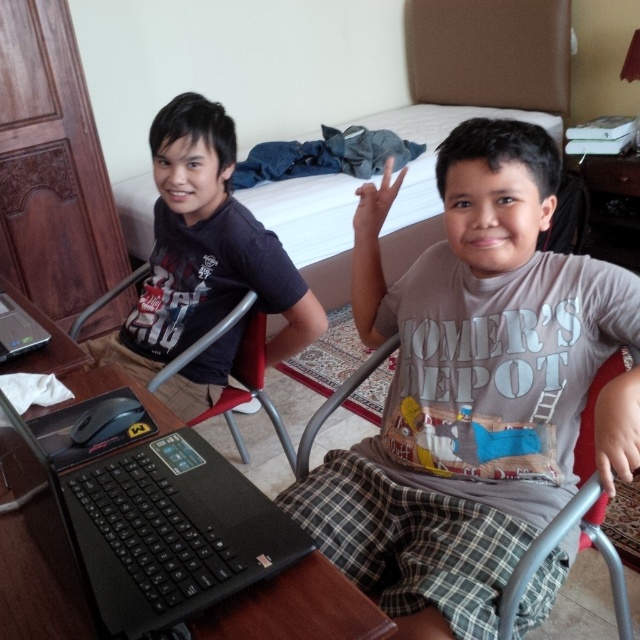
Is black matte laptop at lower left bigger than black matte laptop at left?

Yes.

Between black matte laptop at lower left and black matte laptop at left, which one is positioned higher?

black matte laptop at left is above.

Is point (134, 552) positioned behind point (20, 353)?

No, (134, 552) is closer to viewer.

Find the location of a particular element. The image size is (640, 640). black matte laptop at lower left is located at coordinates (163, 525).

Who is taller, gray cotton t-shirt at center or red plastic chair at left?

With more height is gray cotton t-shirt at center.

In the scene shown: Who is more forward, (404,404) or (188,353)?

Point (404,404) is in front.

Identify the location of gray cotton t-shirt at center. (467, 387).

Does point (205, 349) come behind point (12, 320)?

Yes, it is.

Locate an element on the screen. Image resolution: width=640 pixels, height=640 pixels. matte black shirt at left is located at coordinates (204, 250).